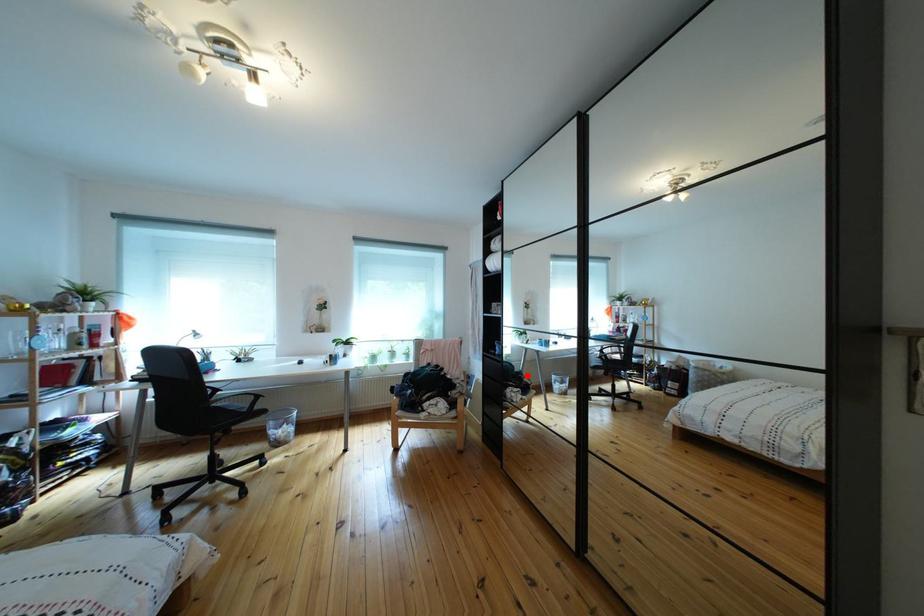
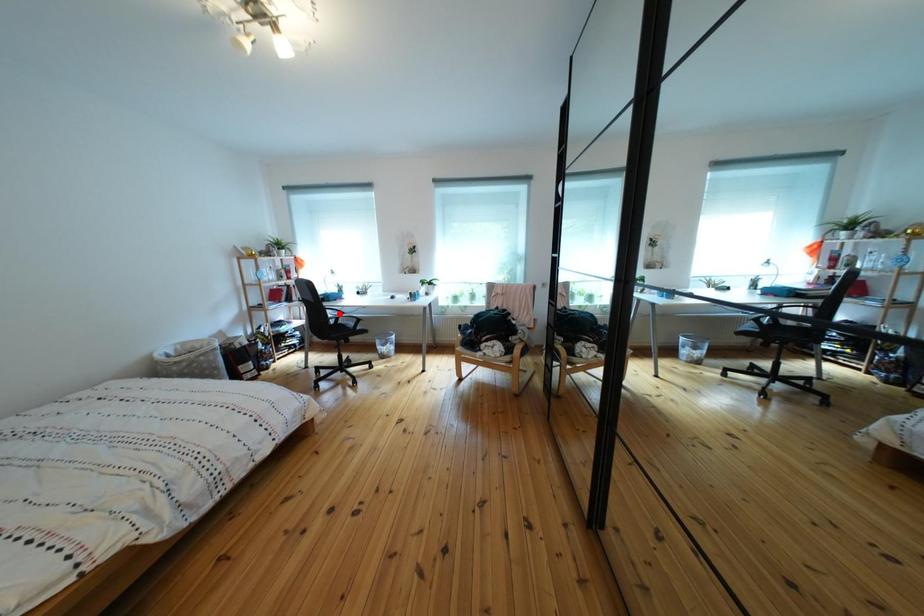
I am providing you with two images of the same scene from different viewpoints. A red point is marked on the first image and another point is marked on the second image. Do the highlighted points in image1 and image2 indicate the same real-world spot?

No